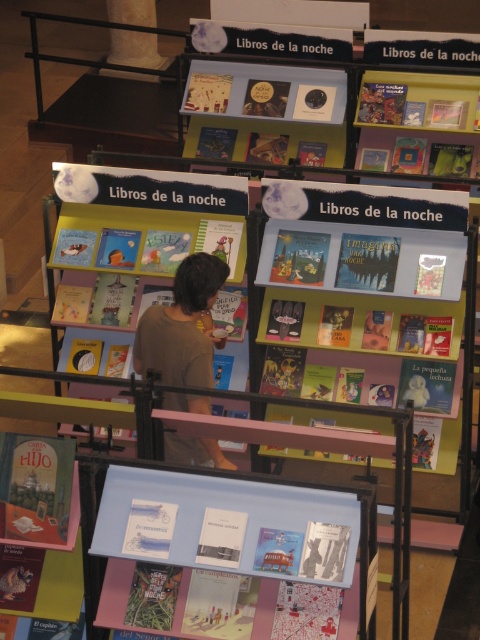
Question: Can you confirm if brown matte shirt at center is smaller than white marble pillar at upper left?

Choices:
 (A) yes
 (B) no

Answer: (A)

Question: From the image, what is the correct spatial relationship of brown matte shirt at center in relation to white marble pillar at upper left?

Choices:
 (A) below
 (B) above

Answer: (A)

Question: Which point is farther to the camera?

Choices:
 (A) (128, 45)
 (B) (151, 497)

Answer: (A)

Question: Which point is farther to the camera?

Choices:
 (A) blue cardboard book display at center
 (B) white marble pillar at upper left
 (C) brown matte shirt at center
 (D) matte yellow book at upper right

Answer: (B)

Question: Does blue cardboard book display at center lie behind white marble pillar at upper left?

Choices:
 (A) yes
 (B) no

Answer: (B)

Question: Based on their relative distances, which object is nearer to the blue cardboard book display at center?

Choices:
 (A) matte yellow book at upper right
 (B) brown matte shirt at center
 (C) hardcover book at lower left

Answer: (C)